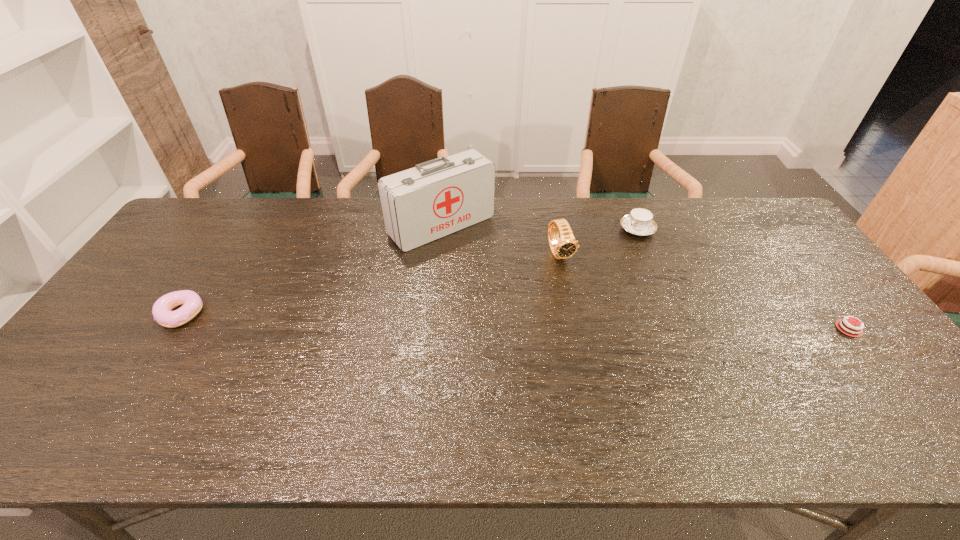
Locate an element on the screen. Image resolution: width=960 pixels, height=540 pixels. vacant space on the desktop that is between the second shortest object and the rightmost object and is positioned on the front-facing side of the tallest object is located at coordinates click(538, 322).

Locate an element on the screen. The image size is (960, 540). vacant space on the desktop that is between the leftmost object and the shortest object and is positioned on the face of the second tallest object is located at coordinates (601, 323).

Locate an element on the screen. Image resolution: width=960 pixels, height=540 pixels. free spot on the desktop that is between the second shortest object and the chocolate cake and is positioned on the side with the handle of the second object from right to left is located at coordinates (516, 321).